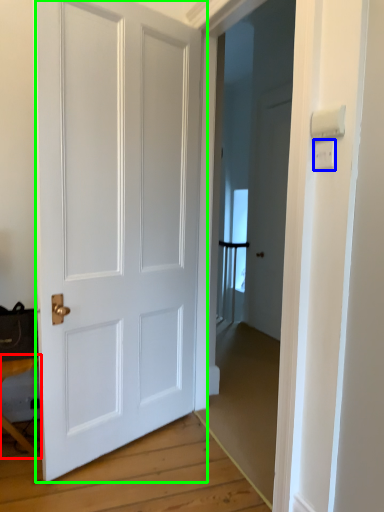
Question: Estimate the real-world distances between objects in this image. Which object is farther from table (highlighted by a red box), light switch (highlighted by a blue box) or door (highlighted by a green box)?

Choices:
 (A) light switch
 (B) door

Answer: (A)